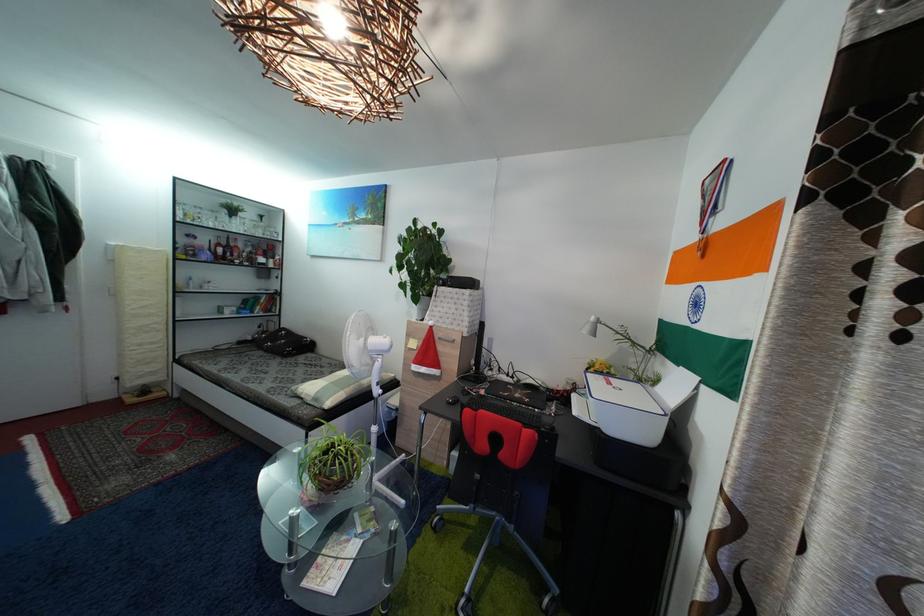
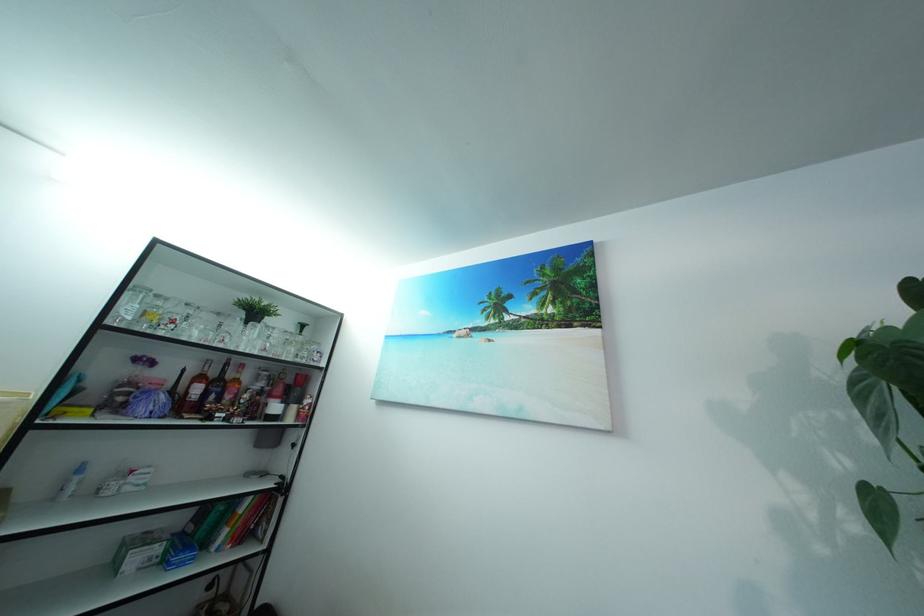
Find the pixel in the second image that matches the point at 260,260 in the first image.

(269, 400)